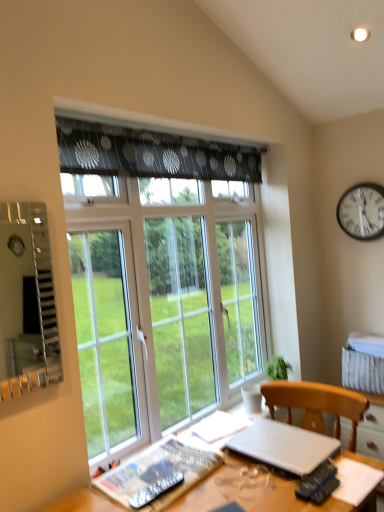
At what (x,y) coordinates should I click in order to perform the action: click on vacant region to the left of metallic silver remote at lower center. Please return your answer as a coordinate pair (x, y). Looking at the image, I should click on (115, 485).